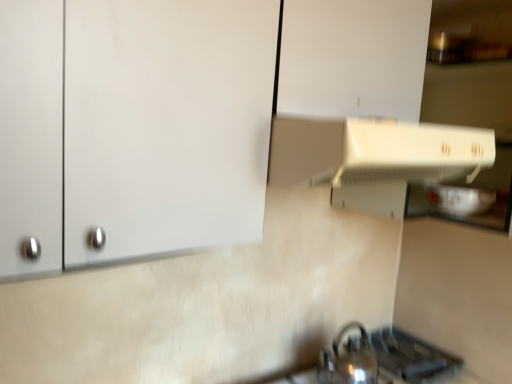
Question: Considering the positions of white matte cabinet at upper left and metallic silver gas stove at lower right in the image, is white matte cabinet at upper left wider or thinner than metallic silver gas stove at lower right?

Choices:
 (A) wide
 (B) thin

Answer: (A)

Question: Considering the positions of white matte cabinet at upper left and metallic silver gas stove at lower right in the image, is white matte cabinet at upper left taller or shorter than metallic silver gas stove at lower right?

Choices:
 (A) tall
 (B) short

Answer: (A)

Question: Estimate the real-world distances between objects in this image. Which object is closer to the white matte cabinet at upper left?

Choices:
 (A) shiny metallic tea pot at lower right
 (B) metallic silver gas stove at lower right

Answer: (A)

Question: Which of these objects is positioned farthest from the white matte cabinet at upper left?

Choices:
 (A) shiny metallic tea pot at lower right
 (B) metallic silver gas stove at lower right

Answer: (B)